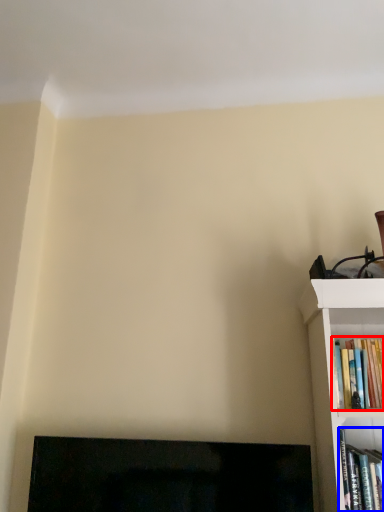
Question: Which of the following is the closest to the observer, book (highlighted by a red box) or book (highlighted by a blue box)?

Choices:
 (A) book
 (B) book

Answer: (B)